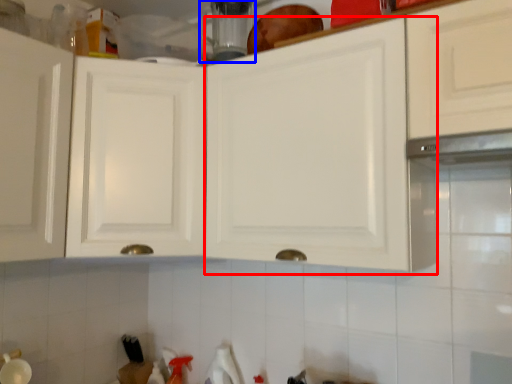
Question: Which of the following is the closest to the observer, cabinetry (highlighted by a red box) or appliance (highlighted by a blue box)?

Choices:
 (A) cabinetry
 (B) appliance

Answer: (A)